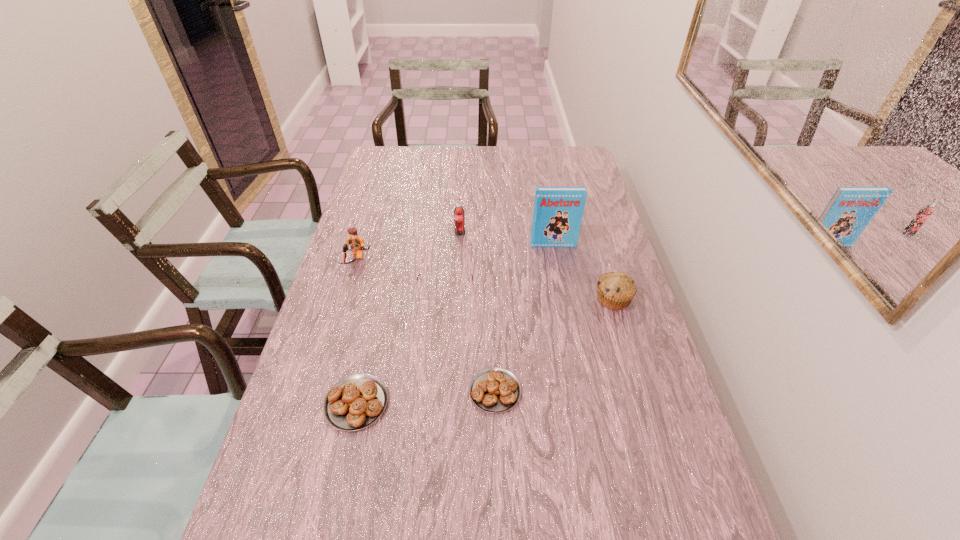
The height and width of the screenshot is (540, 960). I want to click on the sixth tallest object, so click(355, 402).

Find the location of a particular element. This screenshot has height=540, width=960. the left pastry is located at coordinates (355, 402).

This screenshot has width=960, height=540. In order to click on the shortest object in this screenshot , I will do `click(495, 390)`.

At what (x,y) coordinates should I click in order to perform the action: click on the shorter pastry. Please return your answer as a coordinate pair (x, y). Image resolution: width=960 pixels, height=540 pixels. Looking at the image, I should click on tap(495, 390).

Image resolution: width=960 pixels, height=540 pixels. I want to click on the sixth nearest object, so click(558, 211).

You are a GUI agent. You are given a task and a screenshot of the screen. Output one action in this format:
    pyautogui.click(x=<x>, y=<y>)
    Task: Click on the book
    The image size is (960, 540).
    Given the screenshot: What is the action you would take?
    pyautogui.click(x=558, y=211)

The height and width of the screenshot is (540, 960). I want to click on the third tallest object, so click(x=354, y=243).

The height and width of the screenshot is (540, 960). Identify the location of the third farthest object. (354, 243).

The width and height of the screenshot is (960, 540). What are the coordinates of `spectacles` in the screenshot? It's located at (457, 308).

Find the location of `the second tallest object`. the second tallest object is located at coordinates (459, 219).